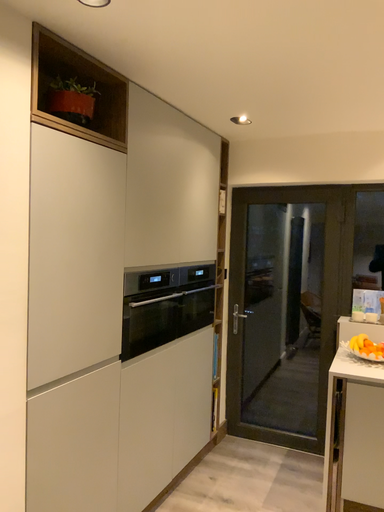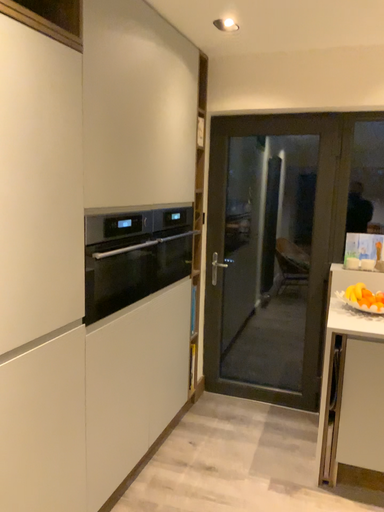
Question: Which way did the camera rotate in the video?

Choices:
 (A) rotated downward
 (B) rotated upward

Answer: (A)